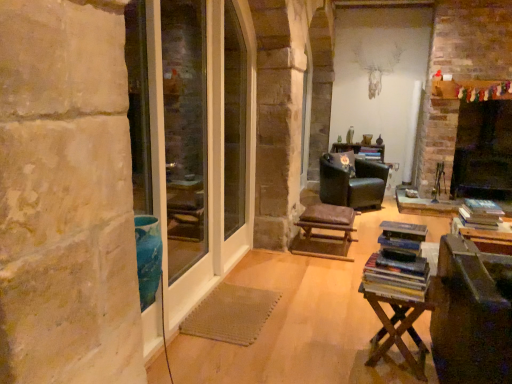
At what (x,y) coordinates should I click in order to perform the action: click on free area in between clear glass door at left, the first screen door viewed from the left, and brown leather stool at center. Please return your answer as a coordinate pair (x, y). Looking at the image, I should click on (268, 286).